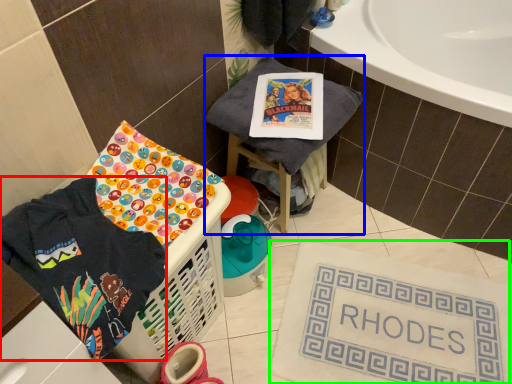
Question: Considering the real-world distances, which object is closest to clothing (highlighted by a red box)? furniture (highlighted by a blue box) or bath mat (highlighted by a green box).

Choices:
 (A) furniture
 (B) bath mat

Answer: (A)